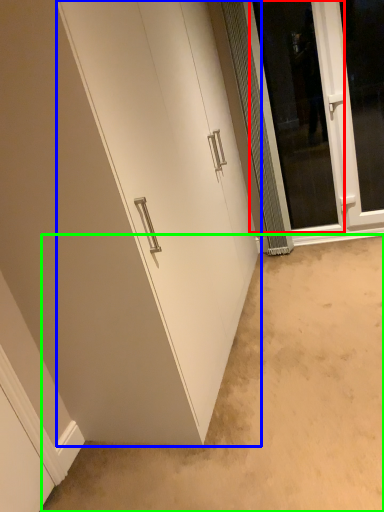
Question: Which object is the closest to the screen door (highlighted by a red box)? Choose among these: door (highlighted by a blue box) or plain (highlighted by a green box).

Choices:
 (A) door
 (B) plain

Answer: (A)